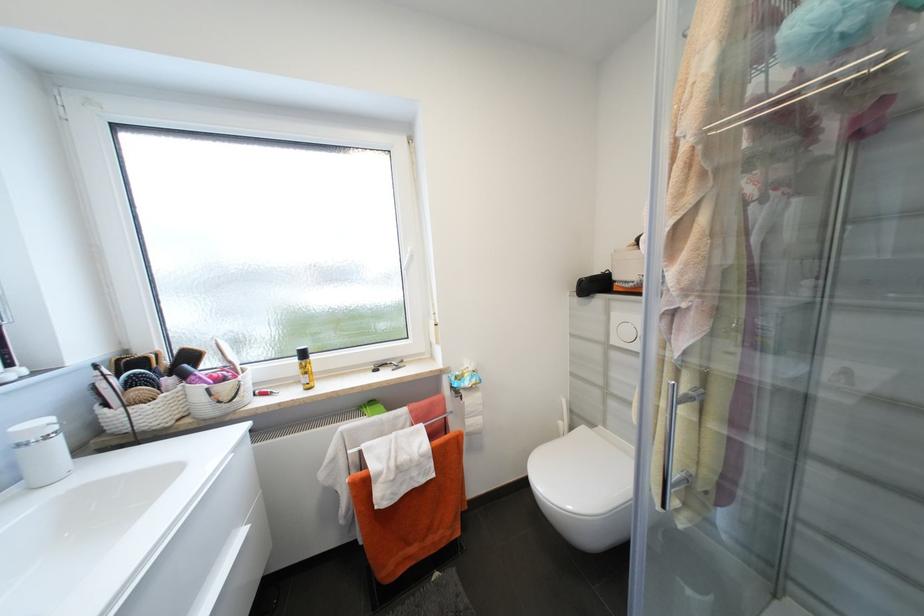
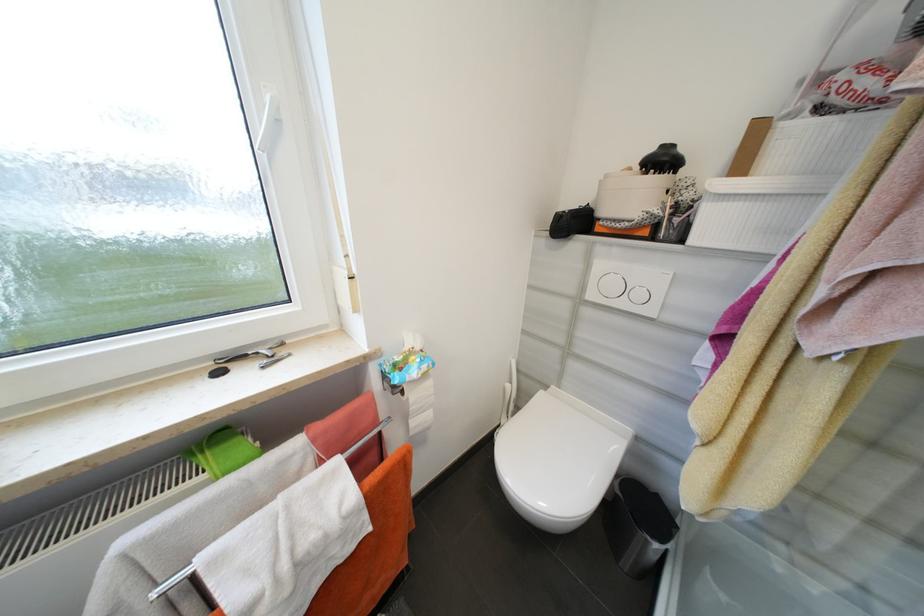
In the second image, find the point that corresponds to (468,399) in the first image.

(407, 392)